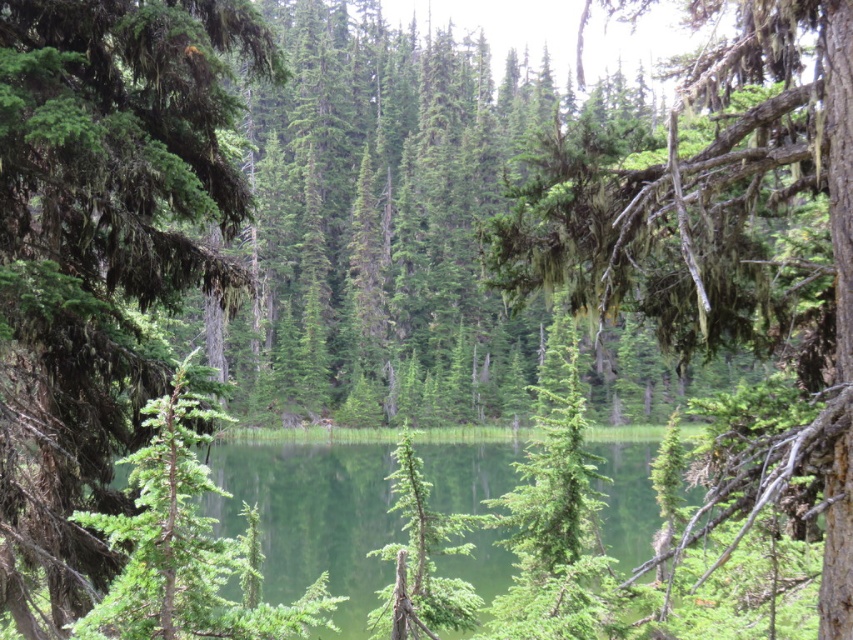
Does green matte tree at center appear on the left side of green reflective water at center?

Correct, you'll find green matte tree at center to the left of green reflective water at center.

Measure the distance between green matte tree at center and camera.

The distance of green matte tree at center from camera is 9.08 meters.

Locate an element on the screen. green matte tree at center is located at coordinates (100, 253).

Which of these two, green matte tree at center or green lichen-covered branch at upper right, stands shorter?

green matte tree at center

Can you confirm if green matte tree at center is taller than green lichen-covered branch at upper right?

Incorrect, green matte tree at center's height is not larger of green lichen-covered branch at upper right's.

Is point (19, 278) positioned after point (695, 198)?

Yes, it is behind point (695, 198).

Locate an element on the screen. The width and height of the screenshot is (853, 640). green matte tree at center is located at coordinates (100, 253).

Is point (627, 259) closer to viewer compared to point (312, 452)?

That is True.

Does green lichen-covered branch at upper right appear over green reflective water at center?

Correct, green lichen-covered branch at upper right is located above green reflective water at center.

Which is in front, point (747, 113) or point (447, 454)?

Point (747, 113) is more forward.

Locate an element on the screen. This screenshot has width=853, height=640. green lichen-covered branch at upper right is located at coordinates (715, 227).